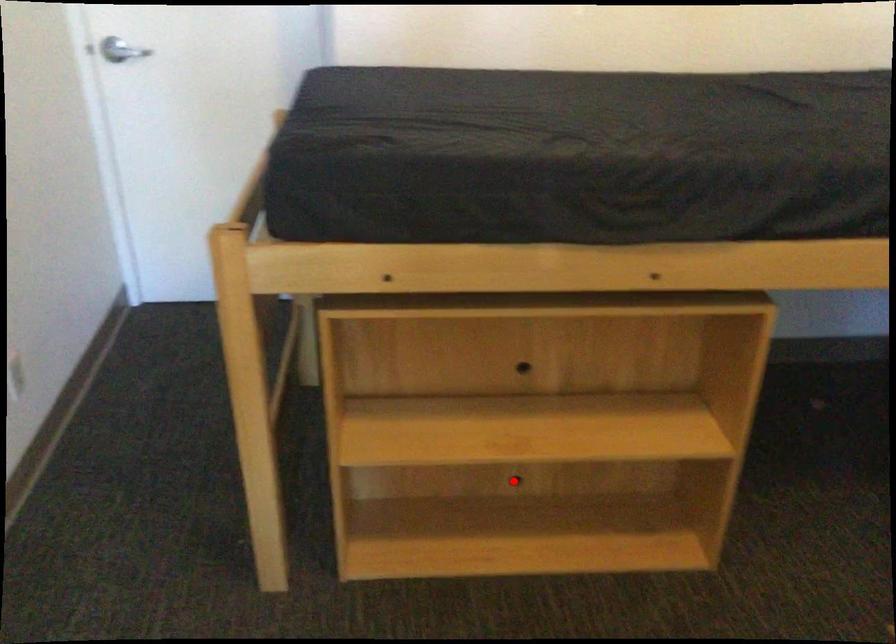
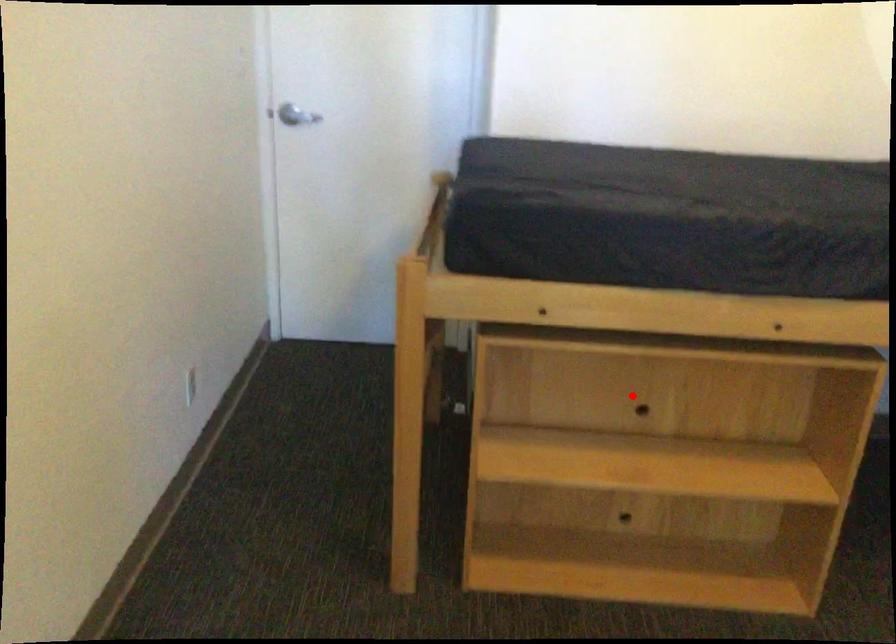
I am providing you with two images of the same scene from different viewpoints. A red point is marked on the first image and another point is marked on the second image. Is the red point in image1 aligned with the point shown in image2?

No